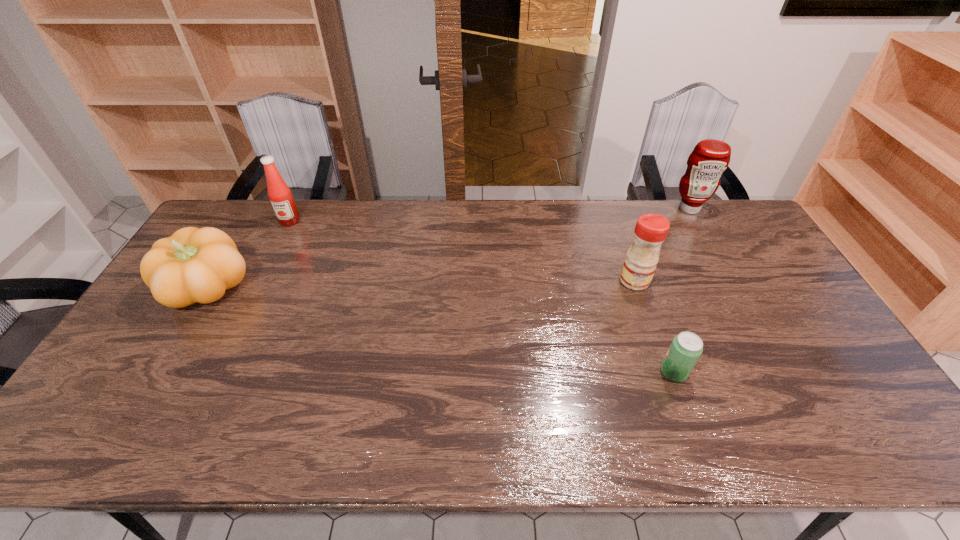
Identify the location of the rightmost condiment. Image resolution: width=960 pixels, height=540 pixels. (706, 163).

You are a GUI agent. You are given a task and a screenshot of the screen. Output one action in this format:
    pyautogui.click(x=<x>, y=<y>)
    Task: Click on the leftmost condiment
    The image size is (960, 540).
    Given the screenshot: What is the action you would take?
    pyautogui.click(x=286, y=212)

The image size is (960, 540). I want to click on the second condiment from left to right, so click(x=641, y=259).

Locate an element on the screen. The width and height of the screenshot is (960, 540). the fourth tallest object is located at coordinates (193, 265).

This screenshot has height=540, width=960. I want to click on the shortest object, so click(x=686, y=348).

I want to click on the nearest object, so click(x=686, y=348).

Find the location of `free region located 0.260m on the front of the rightmost condiment`. free region located 0.260m on the front of the rightmost condiment is located at coordinates (722, 266).

At what (x,y) coordinates should I click in order to perform the action: click on vacant space located on the front-facing side of the leftmost condiment. Please return your answer as a coordinate pair (x, y). The image size is (960, 540). Looking at the image, I should click on (261, 280).

In order to click on vacant space located 0.120m on the left of the second condiment from right to left in this screenshot , I will do `click(581, 281)`.

You are a GUI agent. You are given a task and a screenshot of the screen. Output one action in this format:
    pyautogui.click(x=<x>, y=<y>)
    Task: Click on the free location located on the front of the second shortest object
    
    Given the screenshot: What is the action you would take?
    pyautogui.click(x=130, y=422)